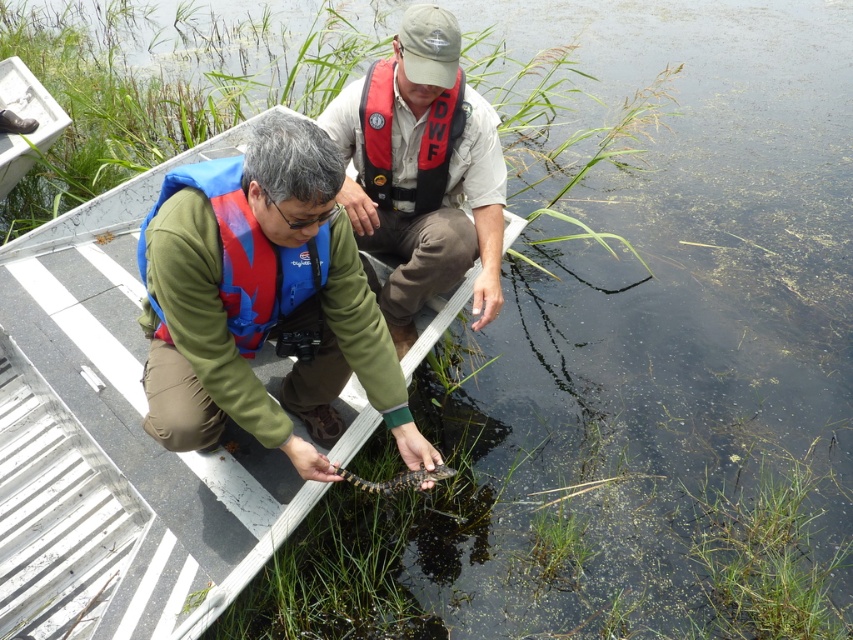
You are a wildlife researcher on a boat. You need to place a large equipment box on the boat. The box is the same size as the matte khaki shirt at center. Will it fit on the metallic aluminum boat at center?

The metallic aluminum boat at center is larger in size than the matte khaki shirt at center. Since the equipment box is the same size as the matte khaki shirt at center, it will fit on the metallic aluminum boat at center.

You are standing on the dock preparing to board the boat. The blue fabric life jacket at lower left is required for safety. Can you reach it from your current position if you can extend your arm 1.8 meters?

The blue fabric life jacket at lower left is 1.93 meters away from the viewer. Since your arm can only extend 1.8 meters, you cannot reach it. You need to move closer before attempting to grab it.